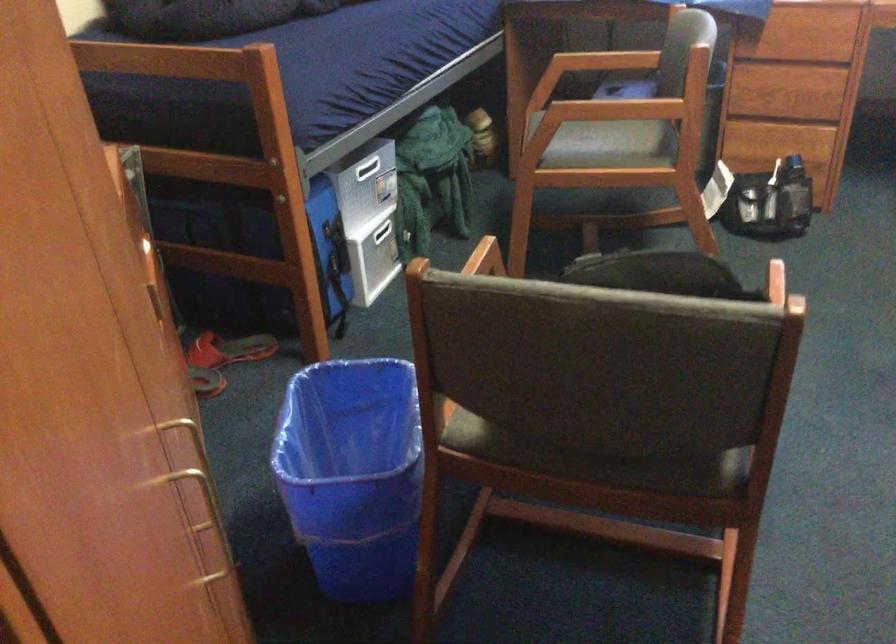
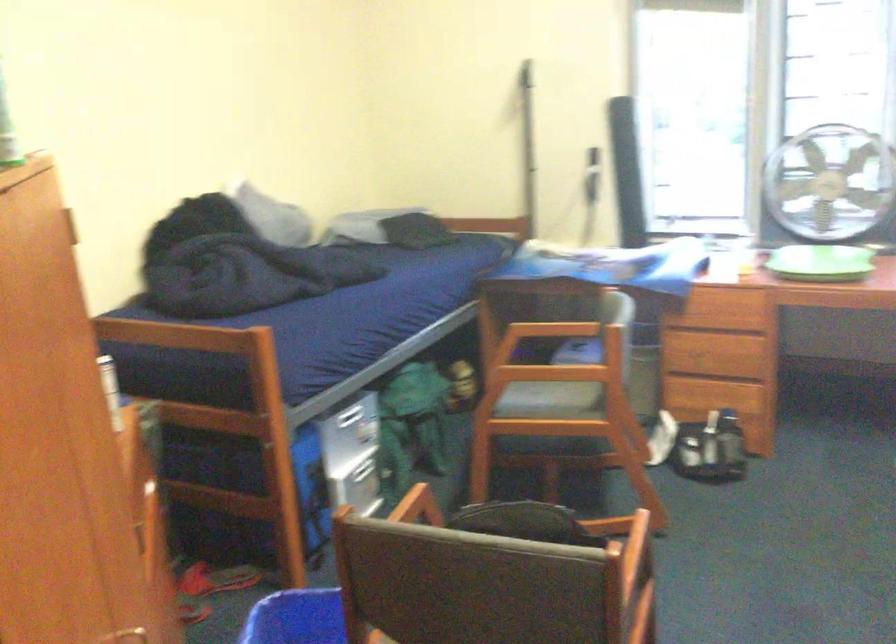
Where in the second image is the point corresponding to point (489, 261) from the first image?

(418, 506)